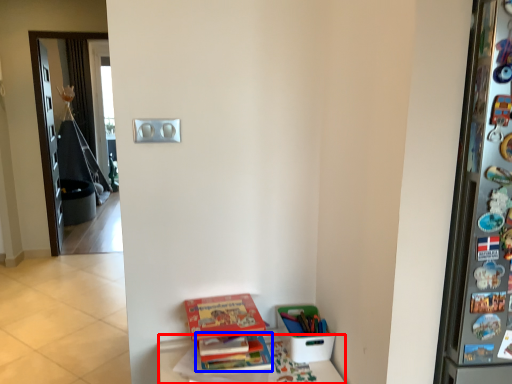
Question: Which object appears closest to the camera in this image, furniture (highlighted by a red box) or book (highlighted by a blue box)?

Choices:
 (A) furniture
 (B) book

Answer: (A)